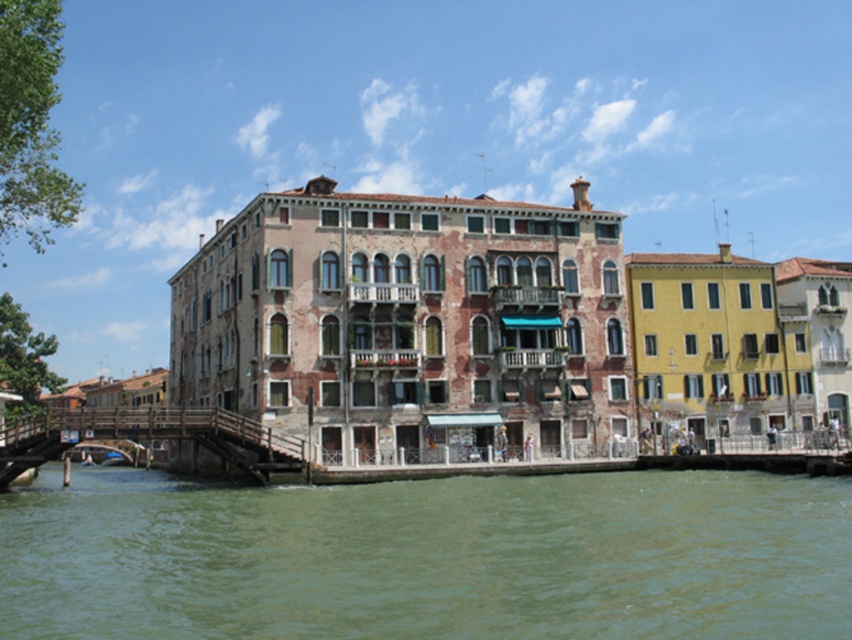
You are a tourist standing on the wooden bridge at lower left and want to take a photo of the green water at lower center. In which direction should you move to get the best view?

The green water at lower center is to the right of the wooden bridge at lower left, so you should move to the right side of the wooden bridge at lower left to get the best view.

You are standing on the wooden bridge at lower left and want to cross to the other side. Is the green water at lower center in front of or behind you as you walk?

The green water at lower center is above the wooden bridge at lower left, so as you stand on the wooden bridge at lower left and walk, the green water at lower center would be above you, not directly in front or behind. However, since the question asks whether it is in front or behind, the answer would be neither, but the water is above the bridge.